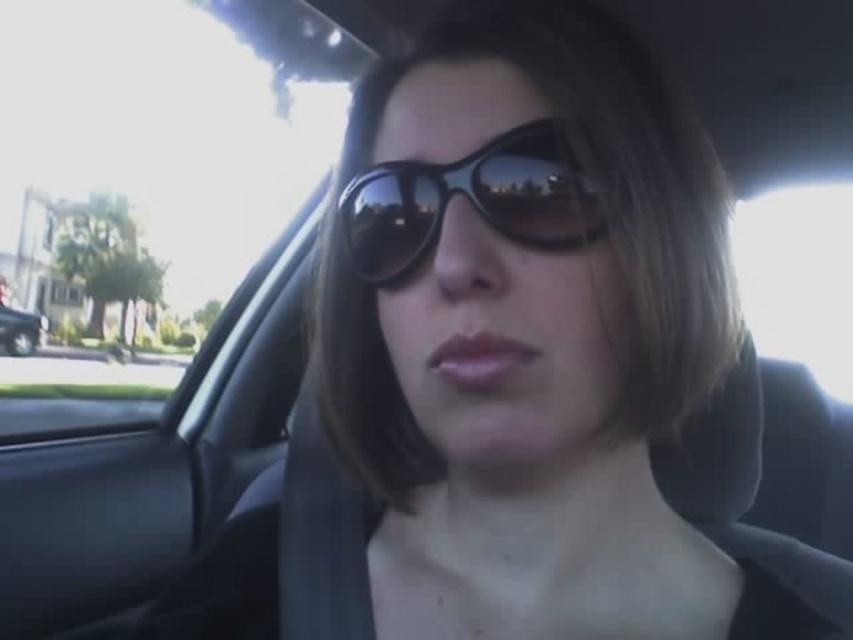
Question: Estimate the real-world distances between objects in this image. Which object is farther from the black reflective sunglasses at center?

Choices:
 (A) transparent glass car window at upper left
 (B) metallic silver car at left

Answer: (B)

Question: Does black reflective sunglasses at center have a larger size compared to metallic silver car at left?

Choices:
 (A) yes
 (B) no

Answer: (B)

Question: Observing the image, what is the correct spatial positioning of black reflective sunglasses at center in reference to metallic silver car at left?

Choices:
 (A) left
 (B) right

Answer: (B)

Question: Which point is closer to the camera taking this photo?

Choices:
 (A) (16, 324)
 (B) (402, 196)

Answer: (B)

Question: Which point is farther to the camera?

Choices:
 (A) (28, 323)
 (B) (143, 330)
 (C) (508, 211)

Answer: (B)

Question: Can you confirm if transparent glass car window at upper left is wider than metallic silver car at left?

Choices:
 (A) no
 (B) yes

Answer: (B)